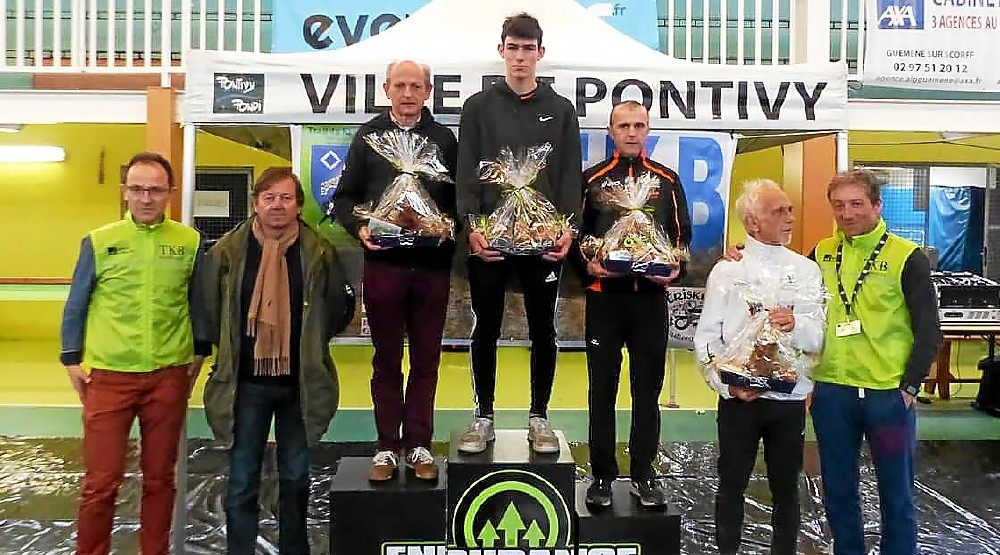
You are a GUI agent. You are given a task and a screenshot of the screen. Output one action in this format:
    pyautogui.click(x=<x>, y=<y>)
    Task: Click on the lights
    This screenshot has width=1000, height=555.
    Given the screenshot: What is the action you would take?
    pyautogui.click(x=21, y=152)